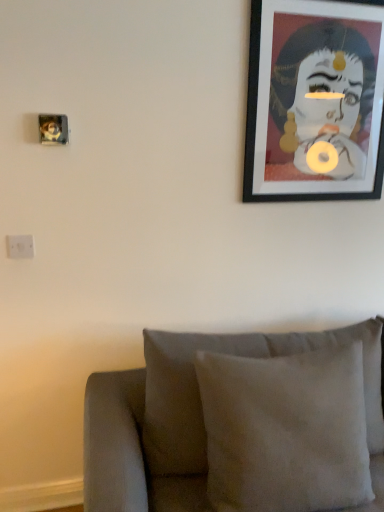
Question: Considering the relative sizes of white plastic electric outlet at left and suede cushion at lower center in the image provided, is white plastic electric outlet at left shorter than suede cushion at lower center?

Choices:
 (A) yes
 (B) no

Answer: (A)

Question: Can suede cushion at lower center be found inside white plastic electric outlet at left?

Choices:
 (A) no
 (B) yes

Answer: (A)

Question: Considering the relative positions of white plastic electric outlet at left and suede cushion at lower center in the image provided, is white plastic electric outlet at left behind suede cushion at lower center?

Choices:
 (A) yes
 (B) no

Answer: (A)

Question: Is white plastic electric outlet at left in front of suede cushion at lower center?

Choices:
 (A) no
 (B) yes

Answer: (A)

Question: From a real-world perspective, is white plastic electric outlet at left located higher than suede cushion at lower center?

Choices:
 (A) no
 (B) yes

Answer: (B)

Question: Is white plastic electric outlet at left positioned with its back to suede cushion at lower center?

Choices:
 (A) no
 (B) yes

Answer: (A)

Question: Can we say suede cushion at lower center lies outside black matte picture frame at upper right?

Choices:
 (A) no
 (B) yes

Answer: (B)

Question: Is suede cushion at lower center aimed at black matte picture frame at upper right?

Choices:
 (A) no
 (B) yes

Answer: (A)

Question: From the image's perspective, would you say suede cushion at lower center is positioned over black matte picture frame at upper right?

Choices:
 (A) yes
 (B) no

Answer: (B)

Question: Does suede cushion at lower center have a smaller size compared to black matte picture frame at upper right?

Choices:
 (A) yes
 (B) no

Answer: (B)

Question: Does suede cushion at lower center touch black matte picture frame at upper right?

Choices:
 (A) yes
 (B) no

Answer: (B)

Question: Considering the relative positions of suede cushion at lower center and black matte picture frame at upper right in the image provided, is suede cushion at lower center to the right of black matte picture frame at upper right from the viewer's perspective?

Choices:
 (A) yes
 (B) no

Answer: (B)

Question: From the image's perspective, is black matte picture frame at upper right located beneath white plastic electric outlet at left?

Choices:
 (A) yes
 (B) no

Answer: (B)